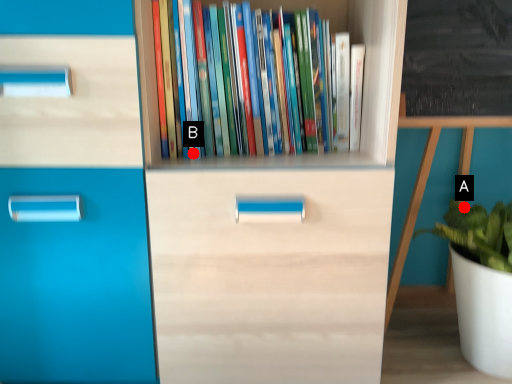
Question: Two points are circled on the image, labeled by A and B beside each circle. Which point is further to the camera?

Choices:
 (A) A is further
 (B) B is further

Answer: (A)